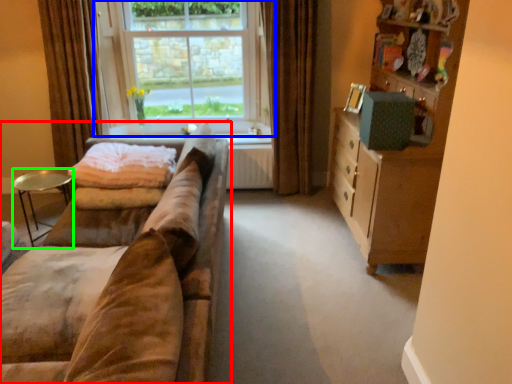
Question: Considering the real-world distances, which object is closest to studio couch (highlighted by a red box)? window (highlighted by a blue box) or table (highlighted by a green box).

Choices:
 (A) window
 (B) table

Answer: (B)